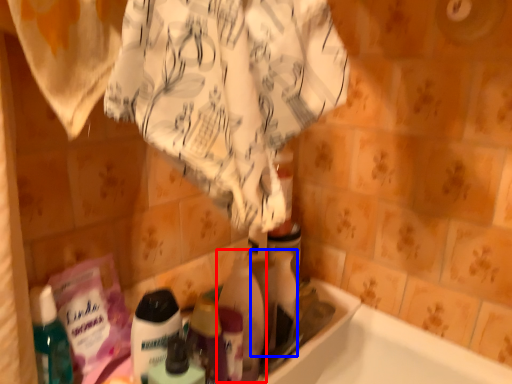
Question: Which object appears farthest to the camera in this image, cleaning product (highlighted by a red box) or cleaning product (highlighted by a blue box)?

Choices:
 (A) cleaning product
 (B) cleaning product

Answer: (B)